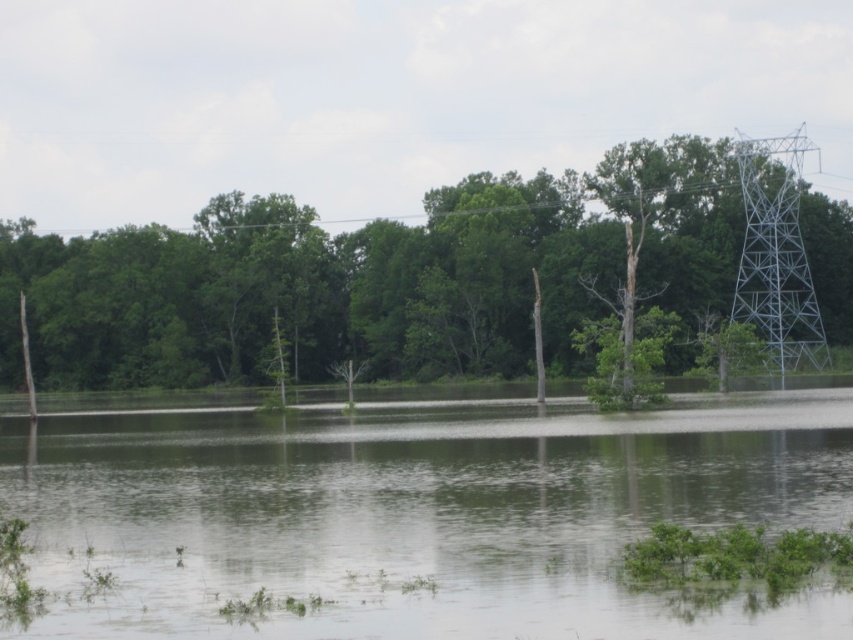
You are a rescue drone operator trying to locate safe areas in the flooded region. You have a map with a point marked at coordinates [421,513]. According to the image, what does this point indicate?

The point at coordinates [421,513] marks clear water at center, indicating a navigable area free of obstructions.

Looking at this image, you are a photographer standing in the flooded area and want to capture both the clear water at center and the metallic gray tower at right in your photo. Which object will appear larger in your photo?

The clear water at center will appear larger in the photo because it is closer to the viewer than the metallic gray tower at right.